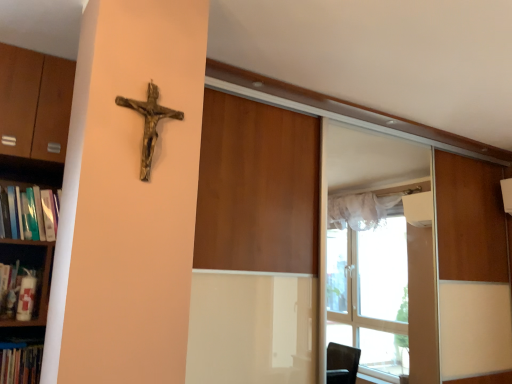
Question: Looking at the image, does hardcover book at left seem bigger or smaller compared to wooden crucifix at upper left?

Choices:
 (A) small
 (B) big

Answer: (B)

Question: From the image's perspective, relative to wooden crucifix at upper left, is hardcover book at left above or below?

Choices:
 (A) below
 (B) above

Answer: (A)

Question: Which is nearer to the wooden crucifix at upper left?

Choices:
 (A) hardcover book at left
 (B) white matte shelf at left, which appears as the 1th shelf when ordered from the bottom
 (C) wooden bookshelf at left, which is counted as the 2th shelf, starting from the bottom

Answer: (C)

Question: Based on their relative distances, which object is farther from the white matte shelf at left, which appears as the 1th shelf when ordered from the bottom?

Choices:
 (A) wooden bookshelf at left, which is counted as the 2th shelf, starting from the bottom
 (B) hardcover book at left
 (C) wooden crucifix at upper left

Answer: (C)